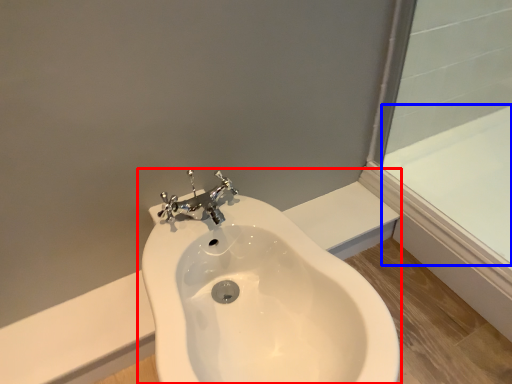
Question: Which of the following is the farthest to the observer, sink (highlighted by a red box) or bath (highlighted by a blue box)?

Choices:
 (A) sink
 (B) bath

Answer: (B)